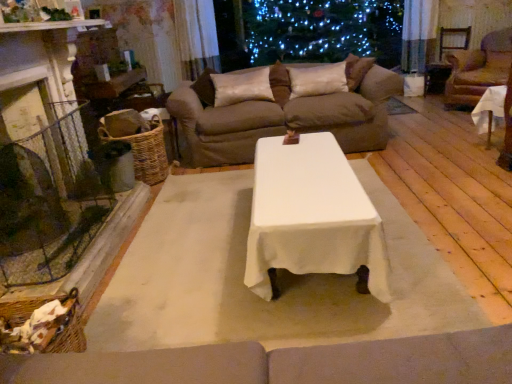
Question: From a real-world perspective, does brown fabric couch at upper center stand above satin curtain at upper center?

Choices:
 (A) yes
 (B) no

Answer: (B)

Question: Can you see brown fabric couch at upper center touching satin curtain at upper center?

Choices:
 (A) no
 (B) yes

Answer: (A)

Question: Does brown fabric couch at upper center have a larger size compared to satin curtain at upper center?

Choices:
 (A) no
 (B) yes

Answer: (B)

Question: From the image's perspective, is brown fabric couch at upper center beneath satin curtain at upper center?

Choices:
 (A) yes
 (B) no

Answer: (A)

Question: Is brown fabric couch at upper center not close to satin curtain at upper center?

Choices:
 (A) no
 (B) yes

Answer: (B)

Question: Is brown fabric couch at upper center wider than satin curtain at upper center?

Choices:
 (A) yes
 (B) no

Answer: (A)

Question: Is white cloth-covered table at right turned away from brown leather armchair at right?

Choices:
 (A) no
 (B) yes

Answer: (A)

Question: Does white cloth-covered table at right turn towards brown leather armchair at right?

Choices:
 (A) yes
 (B) no

Answer: (B)

Question: From a real-world perspective, is white cloth-covered table at right positioned over brown leather armchair at right based on gravity?

Choices:
 (A) yes
 (B) no

Answer: (B)

Question: Would you consider white cloth-covered table at right to be distant from brown leather armchair at right?

Choices:
 (A) no
 (B) yes

Answer: (B)

Question: Can you confirm if white cloth-covered table at right is bigger than brown leather armchair at right?

Choices:
 (A) no
 (B) yes

Answer: (A)

Question: Can you confirm if white cloth-covered table at right is smaller than brown leather armchair at right?

Choices:
 (A) yes
 (B) no

Answer: (A)

Question: Is the position of white cloth-covered table at right less distant than that of satin cushion at center, acting as the second pillow starting from the right?

Choices:
 (A) no
 (B) yes

Answer: (B)